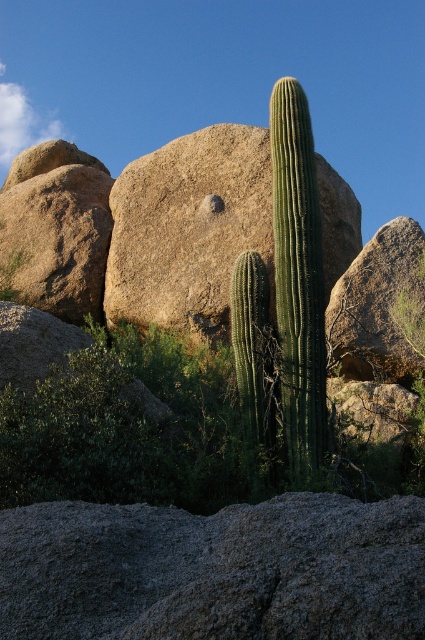
Between point (235, 516) and point (275, 115), which one is positioned in front?

Point (235, 516)

Locate an element on the screen. The image size is (425, 640). gray rough rock at lower center is located at coordinates (215, 570).

Which is more to the left, smooth beige rock at center or green spiny cactus at center?

smooth beige rock at center is more to the left.

Which of these two, smooth beige rock at center or green spiny cactus at center, stands shorter?

With less height is green spiny cactus at center.

Describe the element at coordinates (189, 228) in the screenshot. I see `smooth beige rock at center` at that location.

Identify the location of smooth beige rock at center. Image resolution: width=425 pixels, height=640 pixels. (189, 228).

Between gray rough rock at lower center and rough textured rock at left, which one has less height?

Standing shorter between the two is gray rough rock at lower center.

Looking at this image, is gray rough rock at lower center closer to the viewer compared to rough textured rock at left?

That is True.

This screenshot has width=425, height=640. In order to click on gray rough rock at lower center in this screenshot , I will do `click(215, 570)`.